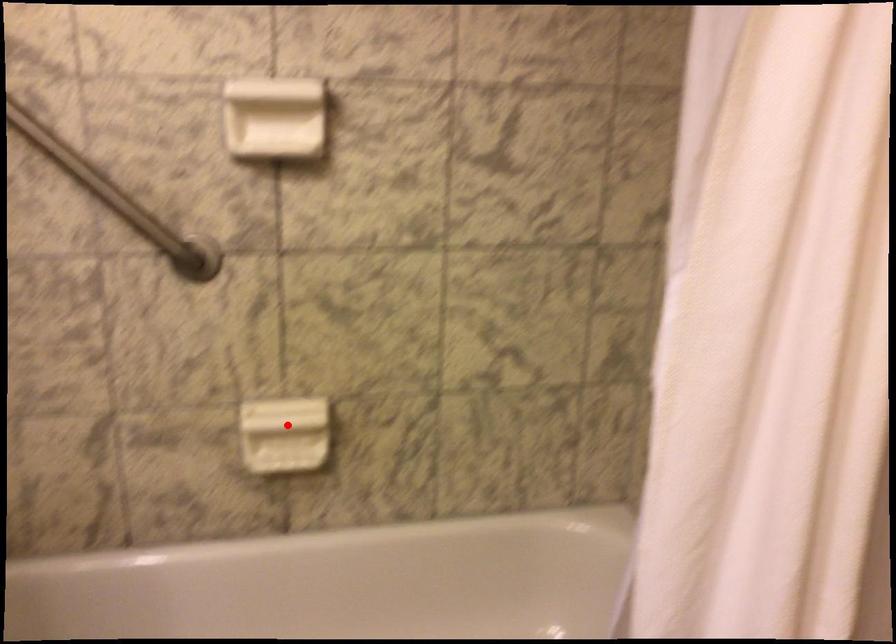
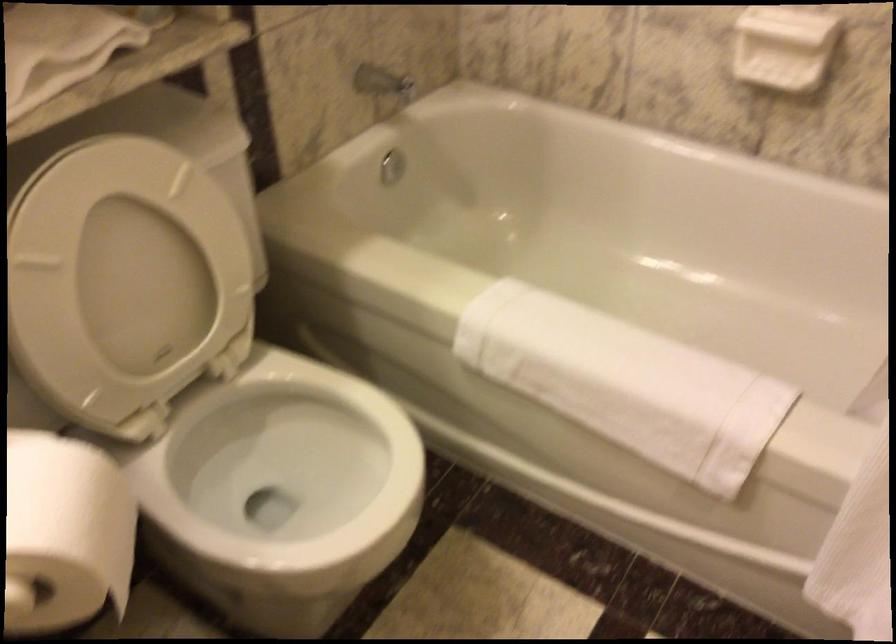
In the second image, find the point that corresponds to the highlighted location in the first image.

(782, 46)